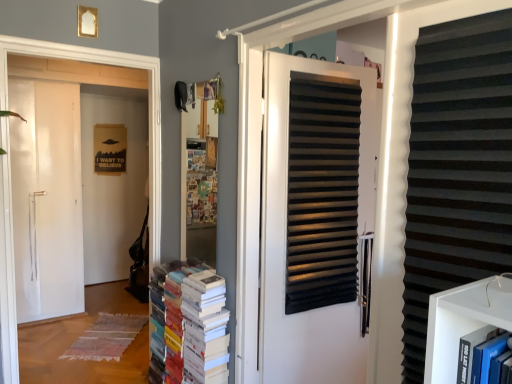
Question: Does black corrugated plastic at right have a smaller size compared to white matte door at center?

Choices:
 (A) no
 (B) yes

Answer: (B)

Question: Is black corrugated plastic at right in contact with white matte door at center?

Choices:
 (A) yes
 (B) no

Answer: (B)

Question: Are black corrugated plastic at right and white matte door at center located far from each other?

Choices:
 (A) no
 (B) yes

Answer: (A)

Question: Is black corrugated plastic at right turned away from white matte door at center?

Choices:
 (A) no
 (B) yes

Answer: (A)

Question: Does black corrugated plastic at right have a greater height compared to white matte door at center?

Choices:
 (A) yes
 (B) no

Answer: (B)

Question: Is white matte door at left inside the boundaries of black corrugated plastic at right, or outside?

Choices:
 (A) inside
 (B) outside

Answer: (B)

Question: Considering the relative positions of white matte door at left and black corrugated plastic at right in the image provided, is white matte door at left to the left or to the right of black corrugated plastic at right?

Choices:
 (A) right
 (B) left

Answer: (B)

Question: From their relative heights in the image, would you say white matte door at left is taller or shorter than black corrugated plastic at right?

Choices:
 (A) short
 (B) tall

Answer: (B)

Question: From a real-world perspective, is white matte door at left above or below black corrugated plastic at right?

Choices:
 (A) below
 (B) above

Answer: (A)

Question: Is point (225, 319) positioned closer to the camera than point (448, 254)?

Choices:
 (A) closer
 (B) farther

Answer: (B)

Question: Choose the correct answer: Is multicolored paper books at center inside black corrugated plastic at right or outside it?

Choices:
 (A) outside
 (B) inside

Answer: (A)

Question: From a real-world perspective, relative to black corrugated plastic at right, is multicolored paper books at center vertically above or below?

Choices:
 (A) above
 (B) below

Answer: (B)

Question: Considering their positions, is multicolored paper books at center located in front of or behind black corrugated plastic at right?

Choices:
 (A) front
 (B) behind

Answer: (B)

Question: From the image's perspective, is white matte door at left located above or below white matte door at center?

Choices:
 (A) above
 (B) below

Answer: (A)

Question: Considering the positions of point (3, 34) and point (352, 155), is point (3, 34) closer or farther from the camera than point (352, 155)?

Choices:
 (A) farther
 (B) closer

Answer: (B)